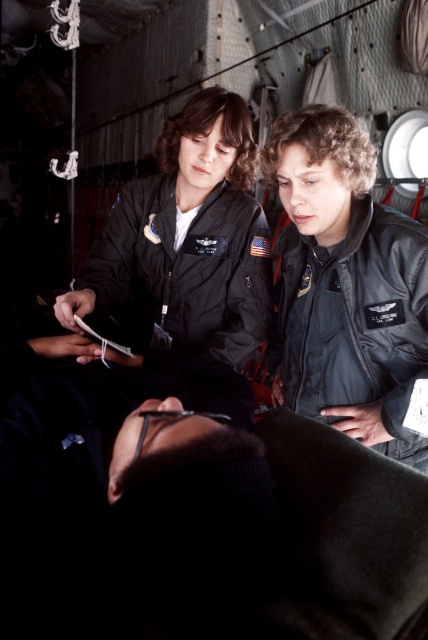
You are a flight attendant on board a military aircraft. You need to retrieve an item from the storage compartment located above the matte black flight suit at center. Can you reach it while standing on the black leather jacket at center?

The black leather jacket at center is positioned under the matte black flight suit at center. Since the jacket is beneath the flight suit, standing on it would allow you to reach the storage compartment above the matte black flight suit at center.